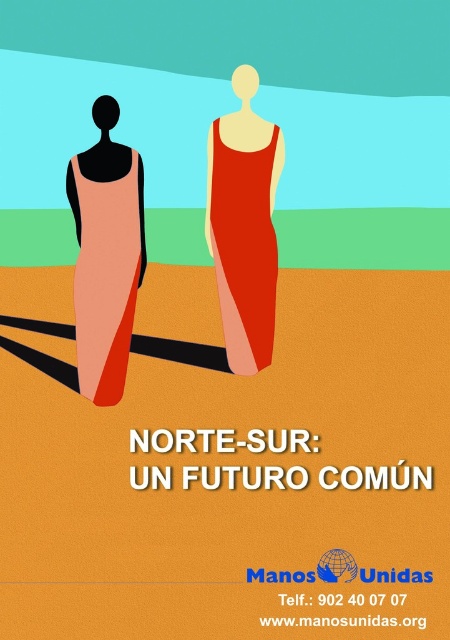
Is matte red dress at center positioned in front of matte peach dress at left?

That is False.

Is matte red dress at center to the right of matte peach dress at left from the viewer's perspective?

Correct, you'll find matte red dress at center to the right of matte peach dress at left.

Where is `matte red dress at center`? matte red dress at center is located at coordinates (243, 250).